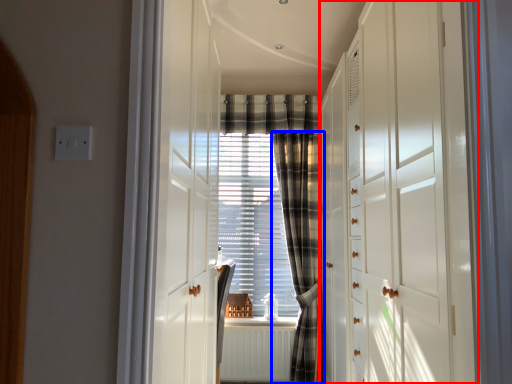
Question: Which point is further to the camera, dresser (highlighted by a red box) or curtain (highlighted by a blue box)?

Choices:
 (A) dresser
 (B) curtain

Answer: (B)